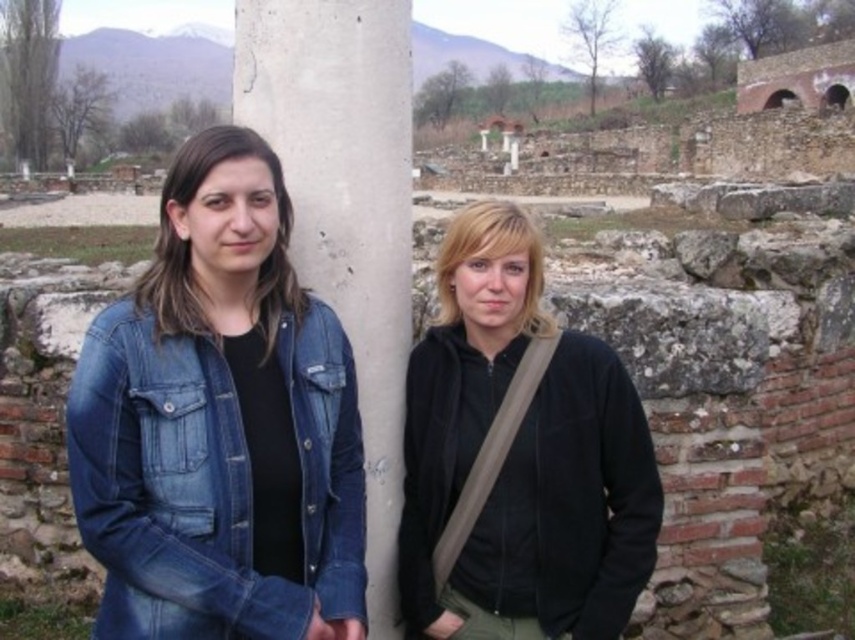
Consider the image. You are a photographer trying to capture a photo of the black matte jacket at center and the gray concrete pillar at center. Based on their heights, which object should you focus on first if you want to ensure both are fully visible in the frame?

The black matte jacket at center is not as tall as the gray concrete pillar at center, so you should focus on the gray concrete pillar at center first to ensure both are fully visible in the frame.